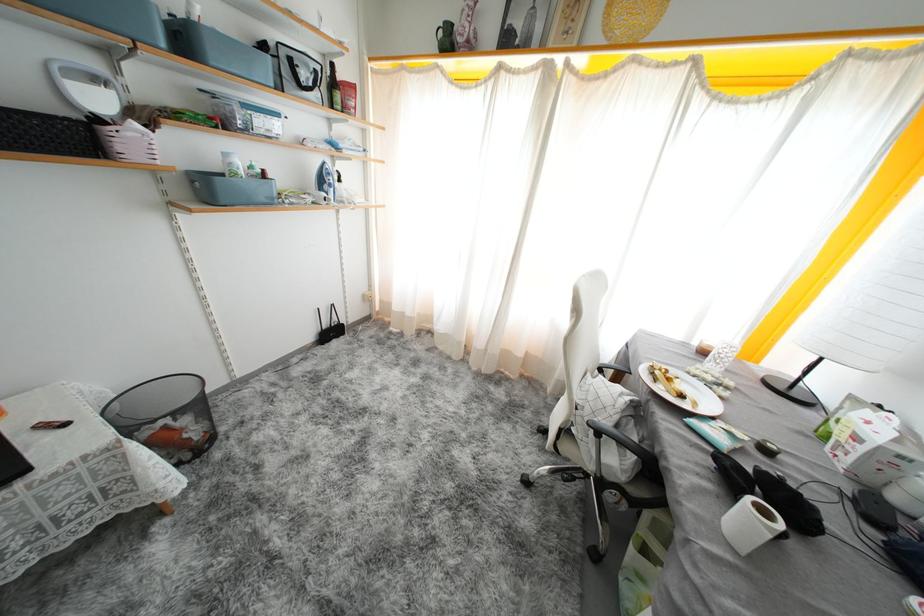
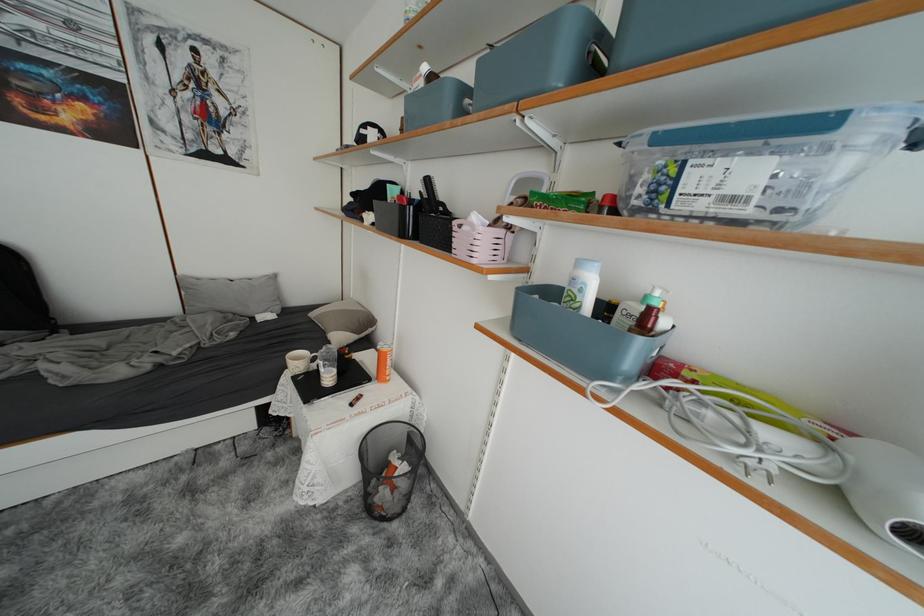
Where in the second image is the point corresponding to point 271,176 from the first image?

(657, 315)